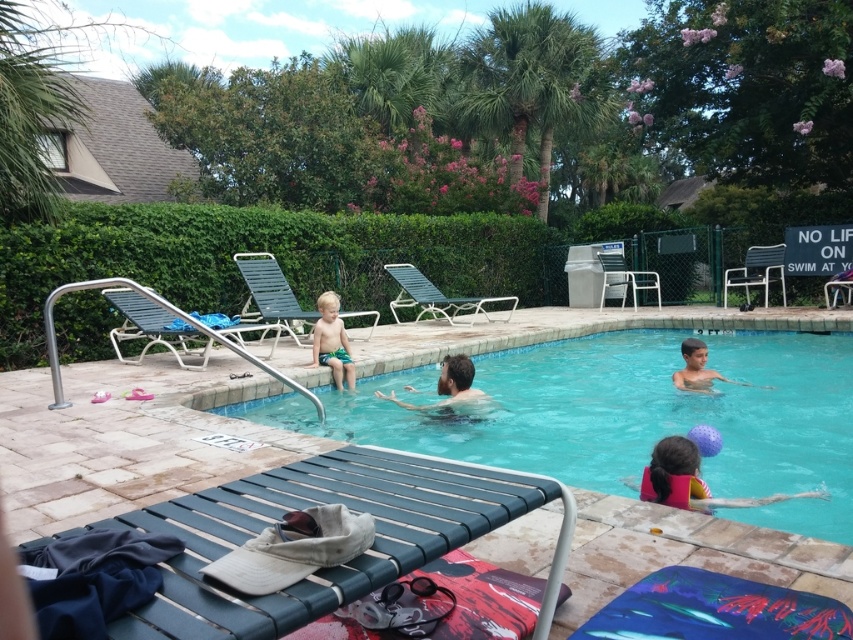
Question: Estimate the real-world distances between objects in this image. Which object is farther from the pink life vest at lower right?

Choices:
 (A) smooth skin boy at center
 (B) clear blue water at center

Answer: (A)

Question: Among these points, which one is nearest to the camera?

Choices:
 (A) (473, 536)
 (B) (486, 400)
 (C) (492, 452)
 (D) (677, 380)

Answer: (A)

Question: Is pink life vest at lower right positioned before green fabric shorts at center?

Choices:
 (A) no
 (B) yes

Answer: (B)

Question: Is blue fabric daybed at lower center thinner than pink life vest at lower right?

Choices:
 (A) no
 (B) yes

Answer: (B)

Question: Which of the following is the farthest from the observer?

Choices:
 (A) pink life vest at lower right
 (B) smooth skin man at center
 (C) blue fabric daybed at lower center
 (D) smooth skin boy at center

Answer: (D)

Question: Is green fabric shorts at center bigger than smooth skin boy at center?

Choices:
 (A) yes
 (B) no

Answer: (B)